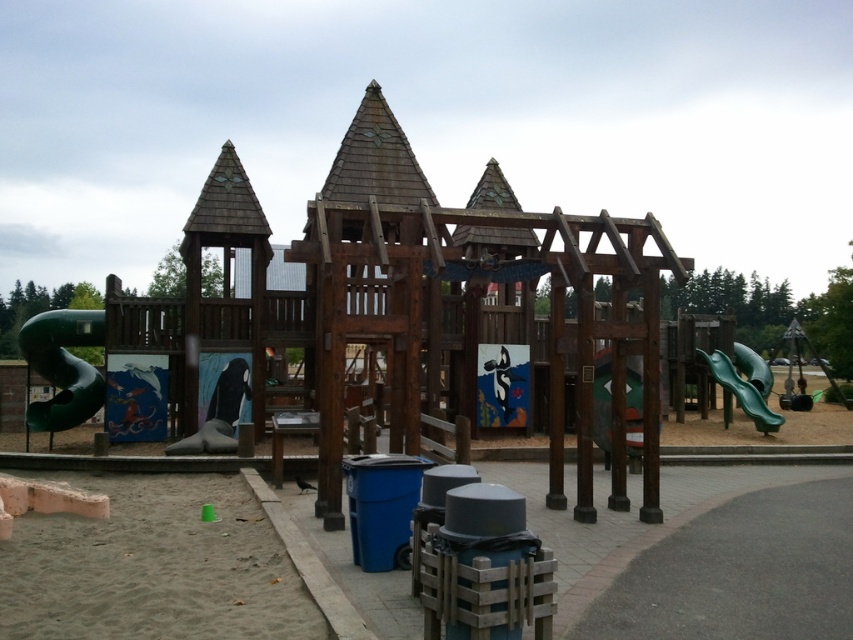
Question: Does green matte slide at left have a greater width compared to green matte slide at center?

Choices:
 (A) yes
 (B) no

Answer: (A)

Question: Which of the following is the closest to the observer?

Choices:
 (A) (634, 388)
 (B) (759, 387)

Answer: (A)

Question: Which point appears closest to the camera in this image?

Choices:
 (A) click(630, 417)
 (B) click(749, 410)
 (C) click(222, 381)

Answer: (A)

Question: Does sandy beige sand at lower left appear on the left side of green matte slide at center?

Choices:
 (A) no
 (B) yes

Answer: (B)

Question: Is green matte slide at left closer to camera compared to green plastic slide at right?

Choices:
 (A) yes
 (B) no

Answer: (A)

Question: Which object is positioned farthest from the sandy beige sand at lower left?

Choices:
 (A) matte black slide at center
 (B) green matte slide at left
 (C) green plastic slide at right

Answer: (C)